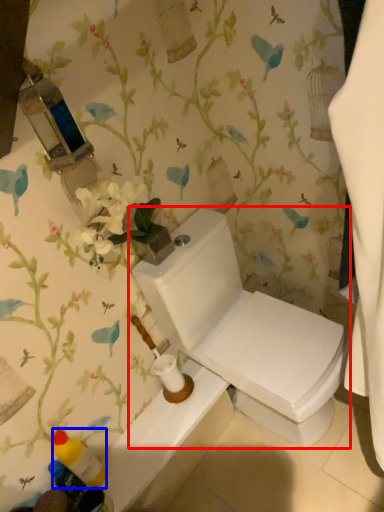
Question: Which object appears closest to the camera in this image, toilet (highlighted by a red box) or toiletry (highlighted by a blue box)?

Choices:
 (A) toilet
 (B) toiletry

Answer: (A)